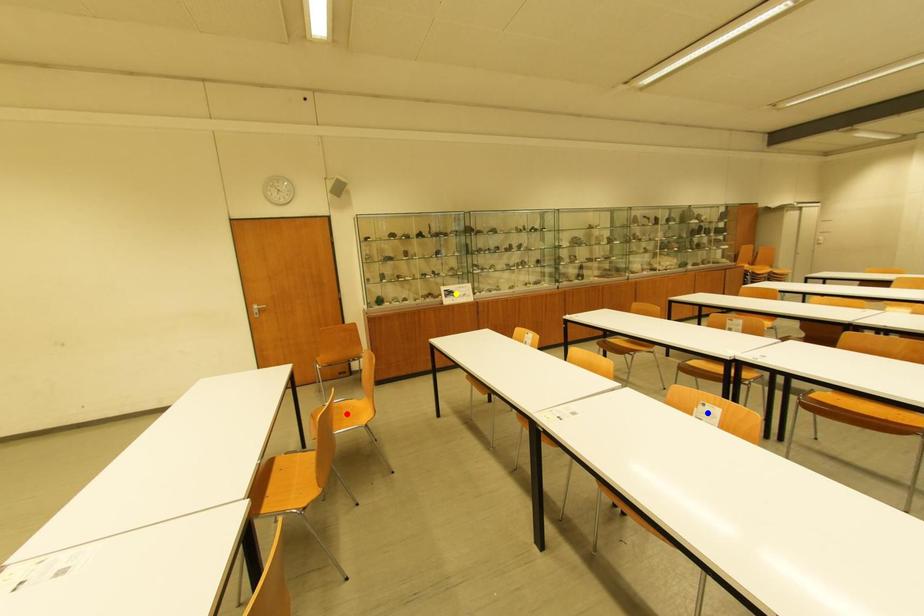
Order these from nearest to farthest:
A) blue point
B) yellow point
C) red point

yellow point, red point, blue point